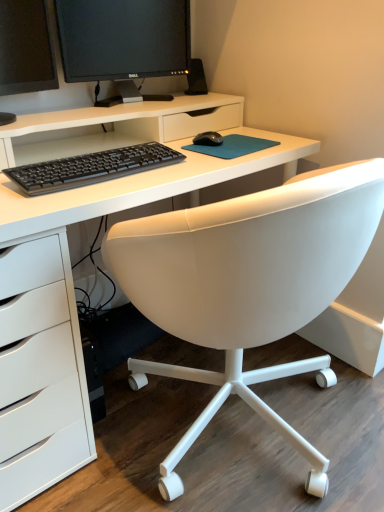
Question: Considering the positions of point (137, 143) and point (210, 137), is point (137, 143) closer or farther from the camera than point (210, 137)?

Choices:
 (A) farther
 (B) closer

Answer: (A)

Question: From the image's perspective, relative to black matte mouse at center, is black matte keyboard at center above or below?

Choices:
 (A) below
 (B) above

Answer: (A)

Question: Which is farther from the black plastic speaker at upper center?

Choices:
 (A) black matte keyboard at center
 (B) black glossy monitor at upper center, the 2th computer monitor when ordered from left to right
 (C) black glossy monitor at upper left, arranged as the second computer monitor when viewed from the right
 (D) white matte desk at center
 (E) black matte mouse at center

Answer: (A)

Question: Which of these objects is positioned closest to the black matte keyboard at center?

Choices:
 (A) black glossy monitor at upper center, the 2th computer monitor when ordered from left to right
 (B) black plastic speaker at upper center
 (C) black matte mouse at center
 (D) white matte desk at center
 (E) black glossy monitor at upper left, placed as the first computer monitor when sorted from left to right

Answer: (D)